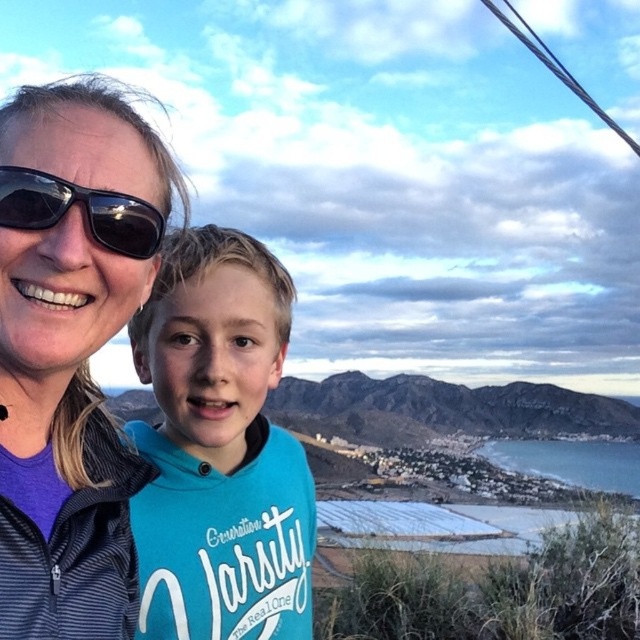
Question: Which object appears farthest from the camera in this image?

Choices:
 (A) black plastic sunglasses at upper left
 (B) matte black jacket at upper left

Answer: (A)

Question: Among these objects, which one is farthest from the camera?

Choices:
 (A) teal jersey at center
 (B) matte black jacket at upper left

Answer: (A)

Question: Is matte black jacket at upper left smaller than teal jersey at center?

Choices:
 (A) no
 (B) yes

Answer: (B)

Question: Among these points, which one is nearest to the camera?

Choices:
 (A) (77, 253)
 (B) (134, 228)

Answer: (A)

Question: Can you confirm if matte black jacket at upper left is wider than black plastic sunglasses at upper left?

Choices:
 (A) yes
 (B) no

Answer: (A)

Question: From the image, what is the correct spatial relationship of matte black jacket at upper left in relation to teal jersey at center?

Choices:
 (A) left
 (B) right

Answer: (A)